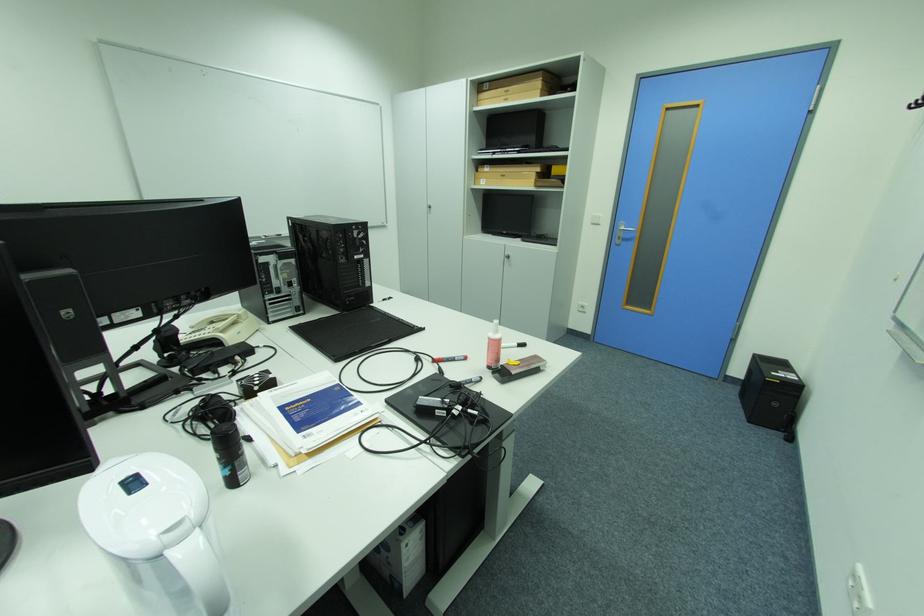
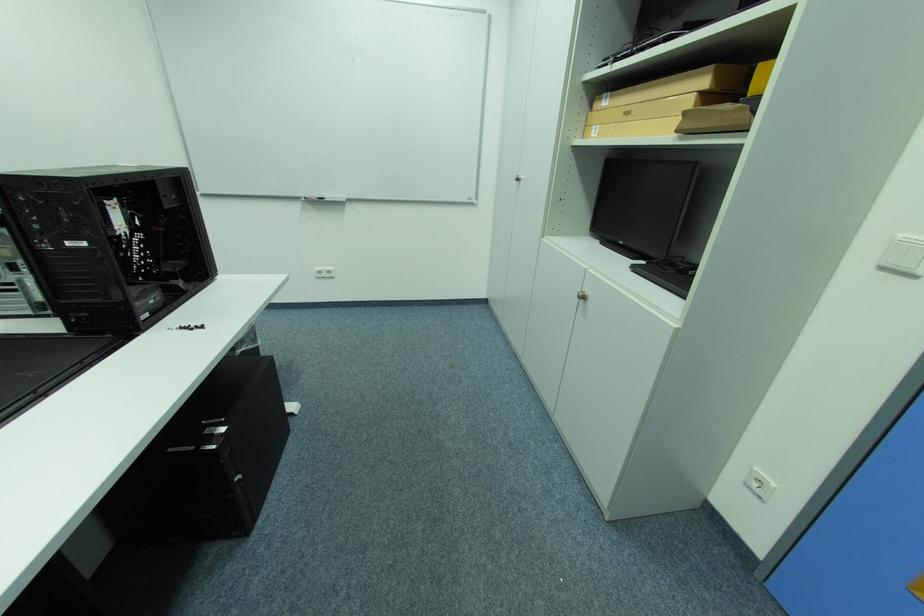
In the second image, find the point that corresponds to pixel 494 168 in the first image.

(614, 98)